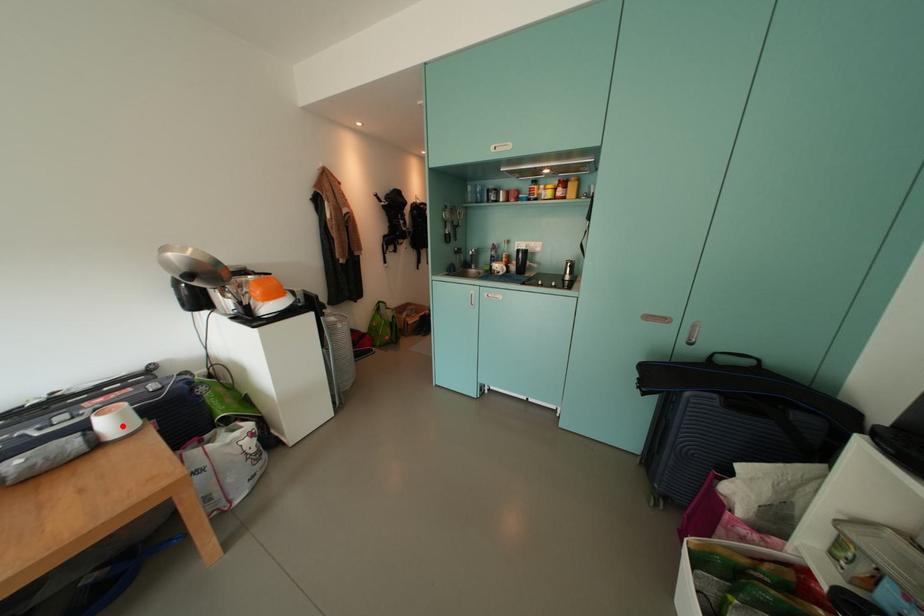
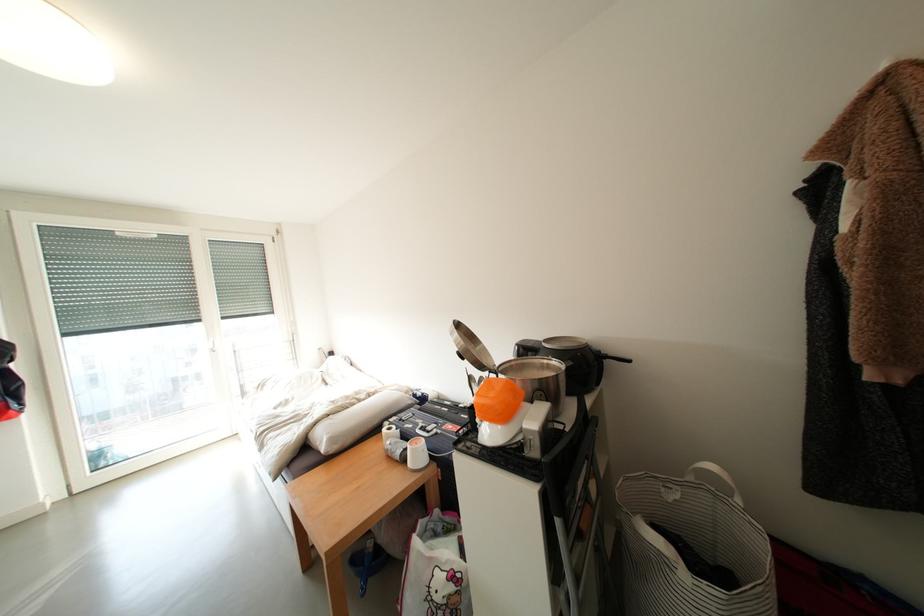
In the second image, find the point that corresponds to the highlighted location in the first image.

(424, 456)